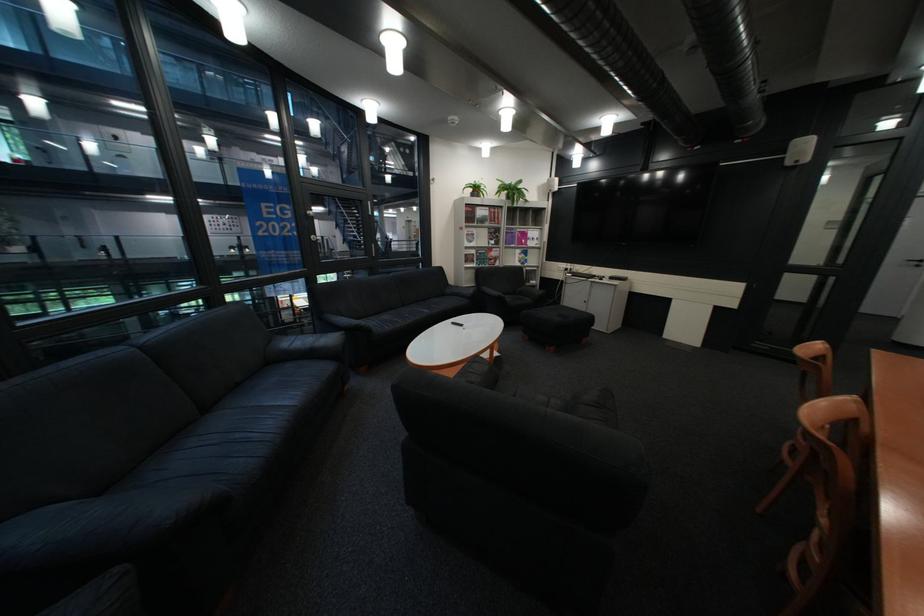
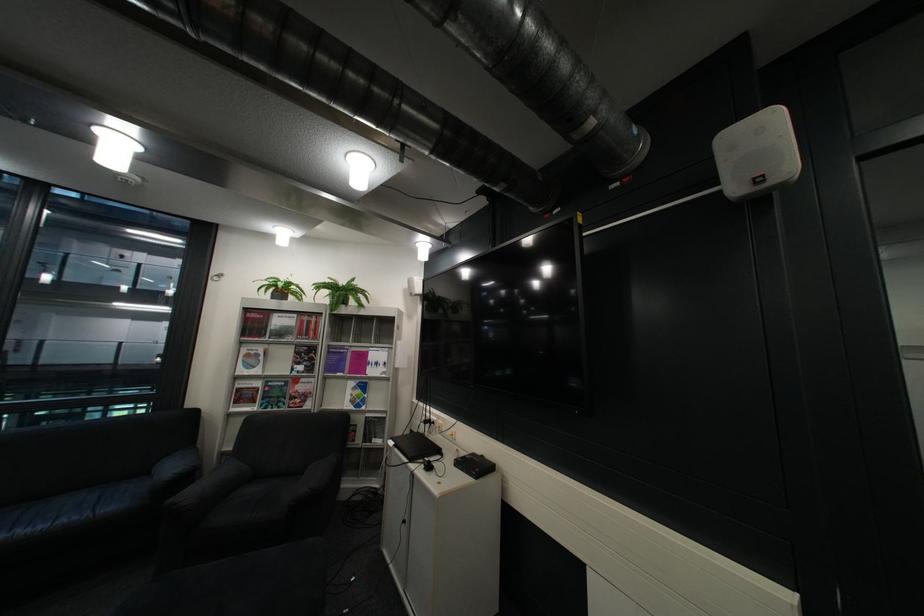
Find the pixel in the second image that matches the point at 548,282 in the first image.

(393, 442)